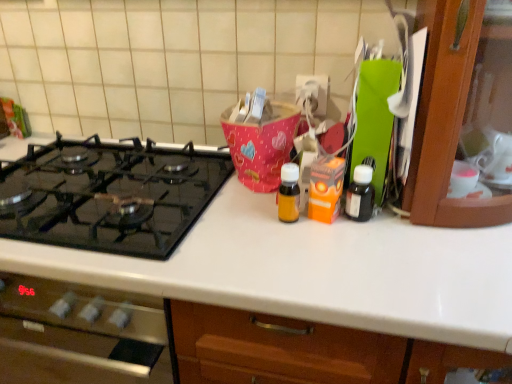
Question: Does black matte bottle at right, which is the second bottle from left to right, appear on the left side of black glass gas stove at left?

Choices:
 (A) yes
 (B) no

Answer: (B)

Question: Considering the relative sizes of black matte bottle at right, which ranks as the first bottle in right-to-left order, and black glass gas stove at left in the image provided, is black matte bottle at right, which ranks as the first bottle in right-to-left order, thinner than black glass gas stove at left?

Choices:
 (A) yes
 (B) no

Answer: (A)

Question: Would you consider black matte bottle at right, which is the second bottle from left to right, to be distant from black glass gas stove at left?

Choices:
 (A) yes
 (B) no

Answer: (B)

Question: Can you confirm if black matte bottle at right, which is the second bottle from left to right, is bigger than black glass gas stove at left?

Choices:
 (A) yes
 (B) no

Answer: (B)

Question: Considering the relative positions of black matte bottle at right, which ranks as the first bottle in right-to-left order, and black glass gas stove at left in the image provided, is black matte bottle at right, which ranks as the first bottle in right-to-left order, behind black glass gas stove at left?

Choices:
 (A) yes
 (B) no

Answer: (A)

Question: In the image, is translucent amber bottle at center, the second bottle positioned from the right, on the left side or the right side of black matte bottle at right, which ranks as the first bottle in right-to-left order?

Choices:
 (A) right
 (B) left

Answer: (B)

Question: Looking at their shapes, would you say translucent amber bottle at center, the second bottle positioned from the right, is wider or thinner than black matte bottle at right, which is the second bottle from left to right?

Choices:
 (A) thin
 (B) wide

Answer: (B)

Question: From a real-world perspective, relative to black matte bottle at right, which ranks as the first bottle in right-to-left order, is translucent amber bottle at center, the second bottle positioned from the right, vertically above or below?

Choices:
 (A) above
 (B) below

Answer: (A)

Question: Is translucent amber bottle at center, acting as the 1th bottle starting from the left, in front of or behind black matte bottle at right, which is the second bottle from left to right, in the image?

Choices:
 (A) behind
 (B) front

Answer: (B)

Question: Is black glass gas stove at left to the left or to the right of translucent amber bottle at center, acting as the 1th bottle starting from the left, in the image?

Choices:
 (A) right
 (B) left

Answer: (B)

Question: Is point (170, 208) positioned closer to the camera than point (280, 200)?

Choices:
 (A) closer
 (B) farther

Answer: (B)

Question: Is black glass gas stove at left wider or thinner than translucent amber bottle at center, the second bottle positioned from the right?

Choices:
 (A) wide
 (B) thin

Answer: (A)

Question: Relative to translucent amber bottle at center, acting as the 1th bottle starting from the left, is black glass gas stove at left in front or behind?

Choices:
 (A) behind
 (B) front

Answer: (B)

Question: In terms of height, does black glass gas stove at left look taller or shorter compared to black matte bottle at right, which ranks as the first bottle in right-to-left order?

Choices:
 (A) tall
 (B) short

Answer: (B)

Question: Would you say black glass gas stove at left is to the left or to the right of black matte bottle at right, which is the second bottle from left to right, in the picture?

Choices:
 (A) right
 (B) left

Answer: (B)